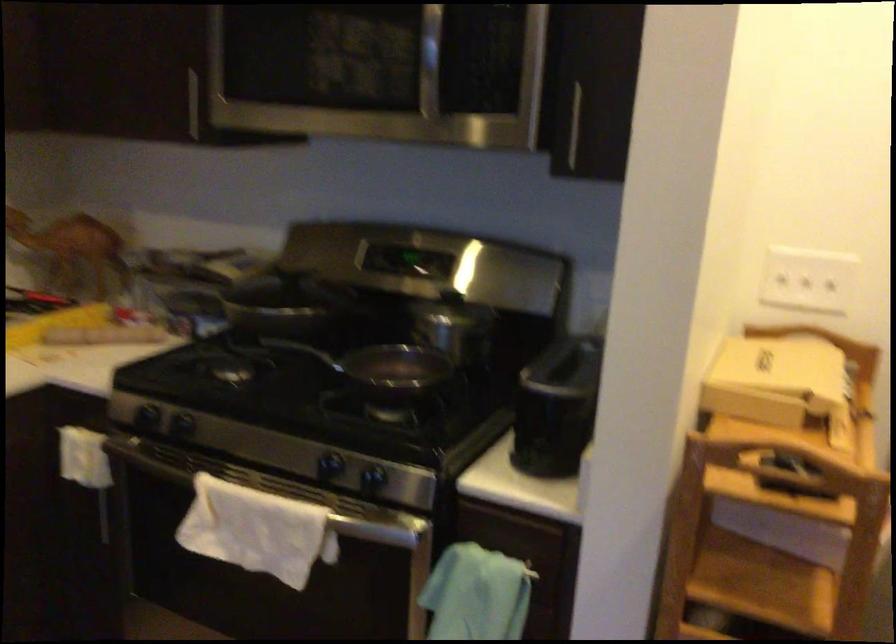
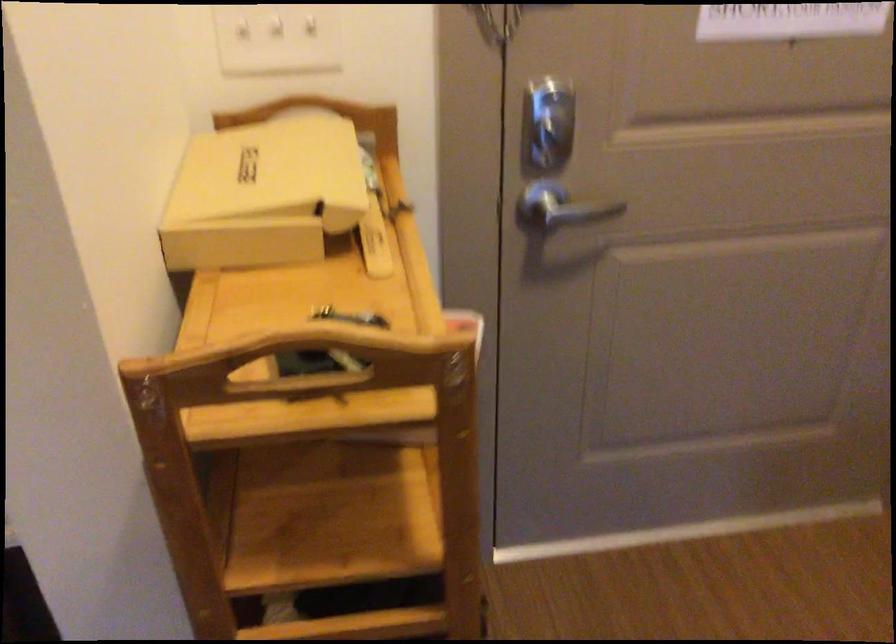
Find the pixel in the second image that matches (777,374) in the first image.

(263, 194)